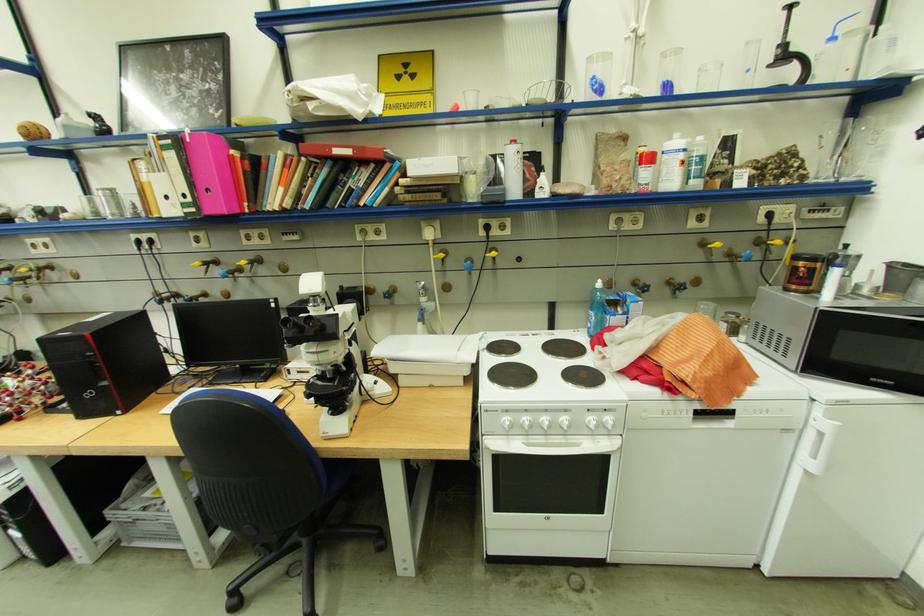
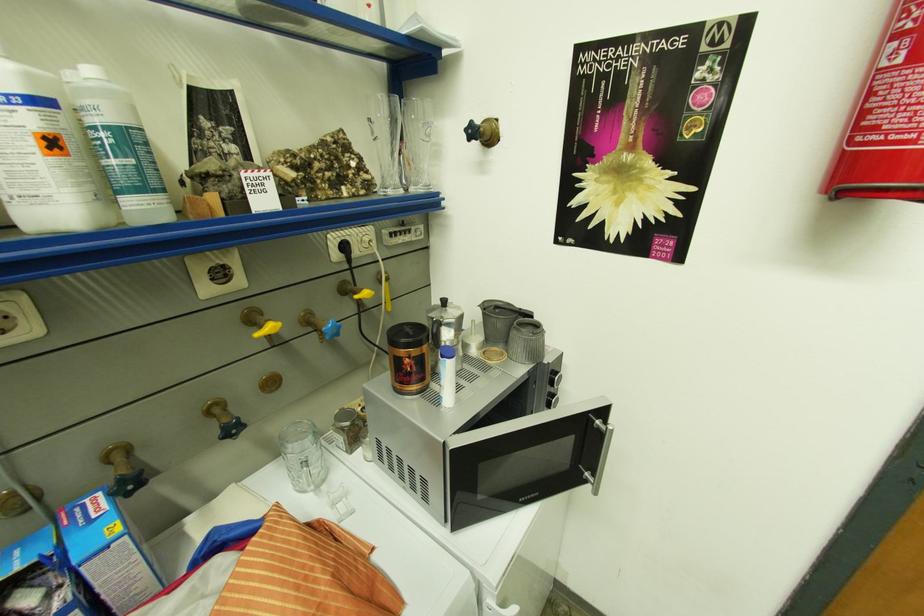
Locate, in the second image, the point that corresponds to point 713,245 in the first image.

(262, 322)